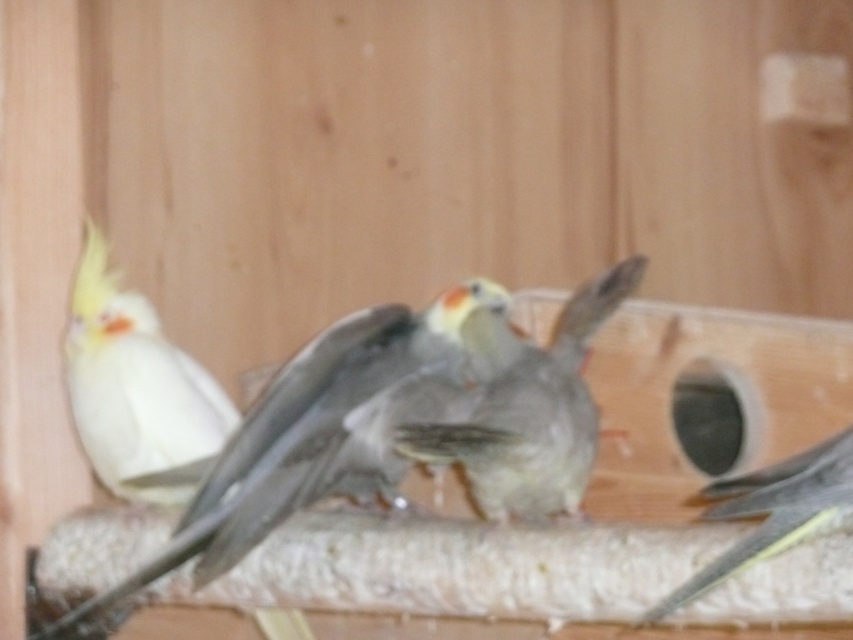
Does white feathered bird at center have a smaller size compared to white feathered parrot at left?

No.

Does point (456, 326) lie behind point (154, 328)?

That is False.

Is point (393, 506) farther from viewer compared to point (135, 365)?

No, it is not.

This screenshot has height=640, width=853. What are the coordinates of `white feathered bird at center` in the screenshot? It's located at (303, 440).

Who is more forward, (531, 392) or (103, 275)?

Point (531, 392) is in front.

Can you confirm if gray matte bird at center is thinner than white feathered parrot at left?

Incorrect, gray matte bird at center's width is not less than white feathered parrot at left's.

Is point (589, 460) farther from camera compared to point (102, 337)?

No, it is not.

The width and height of the screenshot is (853, 640). What are the coordinates of `gray matte bird at center` in the screenshot? It's located at (527, 406).

Is point (321, 365) behind point (569, 342)?

No, (321, 365) is closer to viewer.

Is the position of white feathered bird at center more distant than that of gray matte bird at center?

That is True.

Is point (88, 634) behind point (497, 356)?

Yes, point (88, 634) is behind point (497, 356).

Identify the location of white feathered bird at center. coord(303,440).